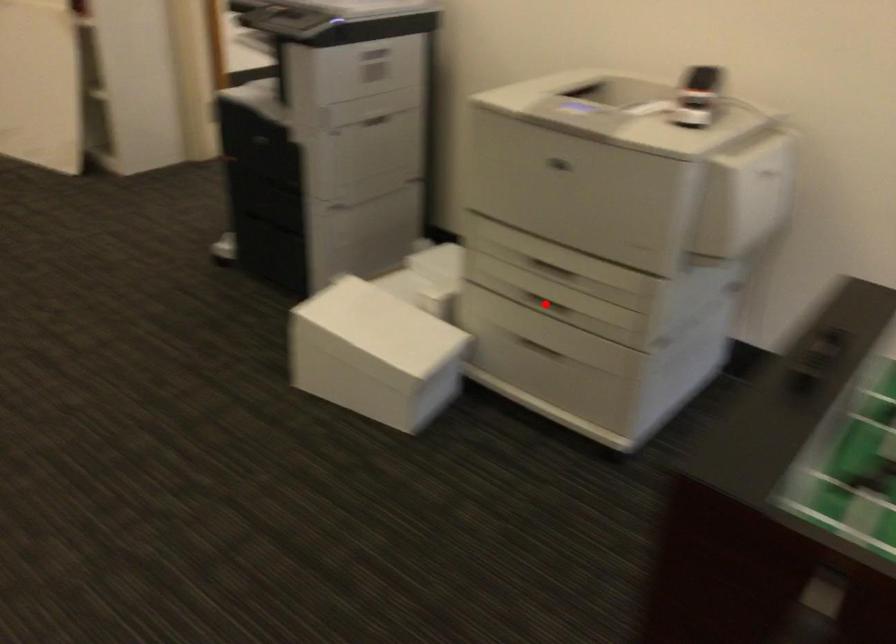
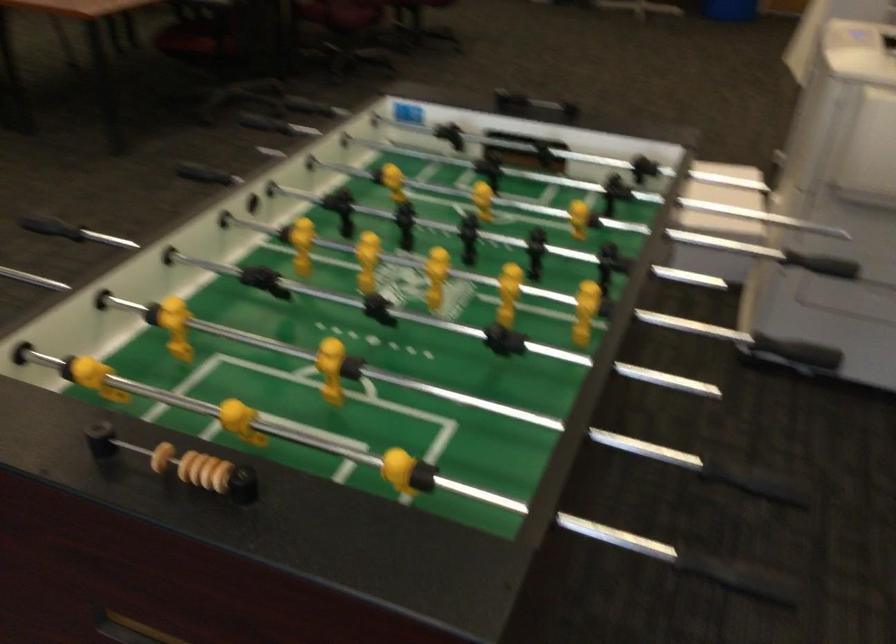
Question: I am providing you with two images of the same scene from different viewpoints. A red point is marked on the first image. At the location where the point appears in image 1, is it still visible in image 2?

Choices:
 (A) Yes
 (B) No

Answer: (B)